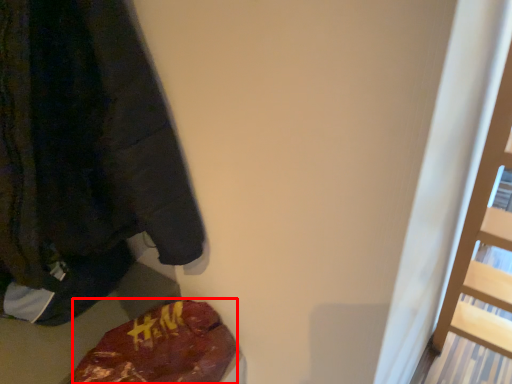
Question: Observing the image, what is the correct spatial positioning of food (annotated by the red box) in reference to sweatshirt?

Choices:
 (A) left
 (B) right

Answer: (B)